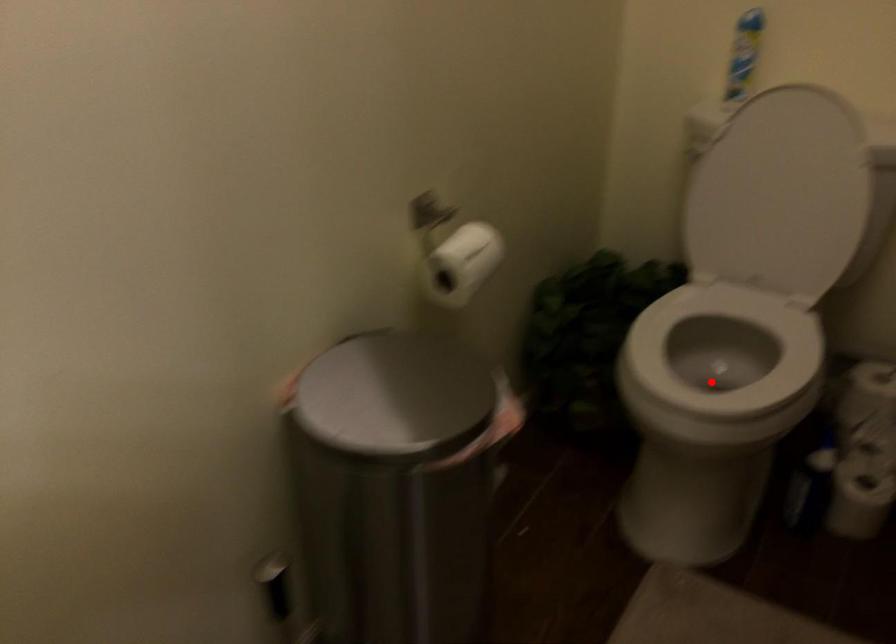
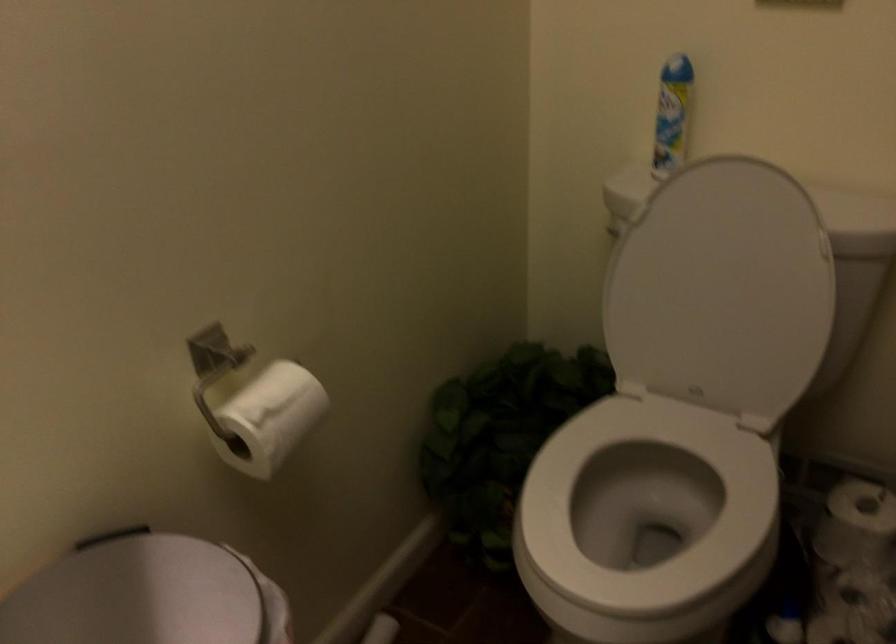
Question: I am providing you with two images of the same scene from different viewpoints. Image1 has a red point marked. In image2, the corresponding 3D location appears at what relative position? Reply with the corresponding letter.

Choices:
 (A) Closer
 (B) Farther

Answer: (A)